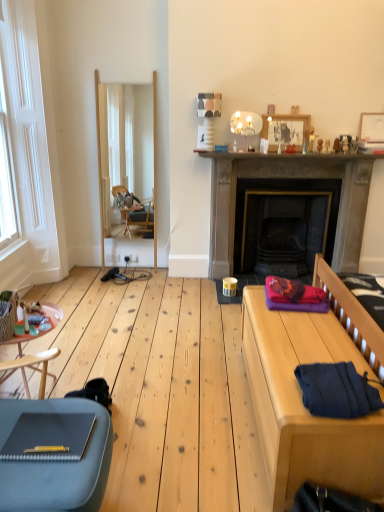
I want to click on vacant region above wooden picture frame at upper center, the 1th picture frame when ordered from left to right (from a real-world perspective), so click(x=286, y=112).